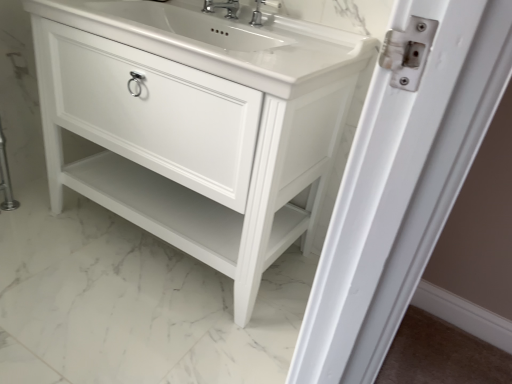
At what (x,y) coordinates should I click in order to perform the action: click on white glossy sink at center. Please return your answer as a coordinate pair (x, y). This screenshot has height=384, width=512. Looking at the image, I should click on (221, 42).

Image resolution: width=512 pixels, height=384 pixels. Describe the element at coordinates (196, 123) in the screenshot. I see `white glossy cabinet at center` at that location.

Locate an element on the screen. polished chrome faucet at upper center, which is the 1th tap from right to left is located at coordinates (264, 12).

Is white glossy cabinet at center in front of white glossy sink at center?

Yes, it is.

How different are the orientations of white glossy cabinet at center and white glossy sink at center in degrees?

white glossy cabinet at center and white glossy sink at center are facing 8.98e-05 degrees away from each other.

From a real-world perspective, which is physically below, white glossy cabinet at center or white glossy sink at center?

white glossy cabinet at center, from a real-world perspective.

Is white glossy sink at center a part of white glossy cabinet at center?

Yes, white glossy sink at center can be found within white glossy cabinet at center.

Is the position of polished chrome faucet at upper center, positioned as the 2th tap in left-to-right order, less distant than that of white glossy sink at center?

No, it is not.

From the image's perspective, is polished chrome faucet at upper center, positioned as the 2th tap in left-to-right order, located above or below white glossy sink at center?

Clearly, from the image's perspective, polished chrome faucet at upper center, positioned as the 2th tap in left-to-right order, is above white glossy sink at center.

Are polished chrome faucet at upper center, positioned as the 2th tap in left-to-right order, and white glossy sink at center located far from each other?

No, there isn't a large distance between polished chrome faucet at upper center, positioned as the 2th tap in left-to-right order, and white glossy sink at center.

Which object is thinner, polished chrome faucet at upper center, positioned as the 2th tap in left-to-right order, or white glossy sink at center?

polished chrome faucet at upper center, positioned as the 2th tap in left-to-right order, is thinner.

Which object is wider, white glossy sink at center or white glossy cabinet at center?

With larger width is white glossy cabinet at center.

From their relative heights in the image, would you say white glossy sink at center is taller or shorter than white glossy cabinet at center?

Clearly, white glossy sink at center is shorter compared to white glossy cabinet at center.

Looking at this image, is white glossy sink at center with white glossy cabinet at center?

No, white glossy sink at center is not in contact with white glossy cabinet at center.

From a real-world perspective, between white glossy sink at center and white glossy cabinet at center, who is vertically lower?

white glossy cabinet at center is physically lower.

Considering the positions of points (216, 3) and (337, 69), is point (216, 3) closer to camera compared to point (337, 69)?

That is False.

Is polished chrome faucet at upper center, the 2th tap from the right, positioned beyond the bounds of white glossy cabinet at center?

No, polished chrome faucet at upper center, the 2th tap from the right, is inside white glossy cabinet at center's boundary.

Are polished chrome faucet at upper center, the first tap viewed from the left, and white glossy cabinet at center located far from each other?

polished chrome faucet at upper center, the first tap viewed from the left, is near white glossy cabinet at center, not far away.

Considering the positions of point (230, 14) and point (248, 62), is point (230, 14) closer or farther from the camera than point (248, 62)?

Point (230, 14).

From a real-world perspective, relative to white glossy sink at center, is polished chrome faucet at upper center, the 2th tap from the right, vertically above or below?

polished chrome faucet at upper center, the 2th tap from the right, is situated higher than white glossy sink at center in the real world.

Can you confirm if polished chrome faucet at upper center, the first tap viewed from the left, is thinner than white glossy sink at center?

Indeed, polished chrome faucet at upper center, the first tap viewed from the left, has a lesser width compared to white glossy sink at center.

Can you confirm if polished chrome faucet at upper center, the first tap viewed from the left, is positioned to the left of white glossy sink at center?

Incorrect, polished chrome faucet at upper center, the first tap viewed from the left, is not on the left side of white glossy sink at center.

From the image's perspective, is white glossy cabinet at center under polished chrome faucet at upper center, the 2th tap from the right?

Yes, from the image's perspective, white glossy cabinet at center is below polished chrome faucet at upper center, the 2th tap from the right.

From a real-world perspective, is white glossy cabinet at center positioned above or below polished chrome faucet at upper center, the first tap viewed from the left?

Clearly, from a real-world perspective, white glossy cabinet at center is below polished chrome faucet at upper center, the first tap viewed from the left.

Is white glossy cabinet at center not near polished chrome faucet at upper center, the 2th tap from the right?

They are positioned close to each other.

The image size is (512, 384). Find the location of `bathroom cabinet below the polished chrome faucet at upper center, the 2th tap from the right (from the image's perspective)`. bathroom cabinet below the polished chrome faucet at upper center, the 2th tap from the right (from the image's perspective) is located at coordinates (196, 123).

Do you think polished chrome faucet at upper center, positioned as the 2th tap in left-to-right order, is within white glossy cabinet at center, or outside of it?

polished chrome faucet at upper center, positioned as the 2th tap in left-to-right order, is located inside white glossy cabinet at center.

Is polished chrome faucet at upper center, positioned as the 2th tap in left-to-right order, looking in the opposite direction of white glossy cabinet at center?

polished chrome faucet at upper center, positioned as the 2th tap in left-to-right order, does not have its back to white glossy cabinet at center.

Which of these two, polished chrome faucet at upper center, which is the 1th tap from right to left, or white glossy cabinet at center, stands taller?

With more height is white glossy cabinet at center.

From a real-world perspective, is polished chrome faucet at upper center, positioned as the 2th tap in left-to-right order, positioned over white glossy cabinet at center based on gravity?

Yes, from a real-world perspective, polished chrome faucet at upper center, positioned as the 2th tap in left-to-right order, is over white glossy cabinet at center

This screenshot has height=384, width=512. In order to click on counter top above the white glossy cabinet at center (from the image's perspective) in this screenshot , I will do `click(221, 42)`.

You are a GUI agent. You are given a task and a screenshot of the screen. Output one action in this format:
    pyautogui.click(x=<x>, y=<y>)
    Task: Click on the 2nd tap to the right when counting from the white glossy sink at center
    The image size is (512, 384).
    Given the screenshot: What is the action you would take?
    pyautogui.click(x=264, y=12)

Estimate the real-world distances between objects in this image. Which object is closer to polished chrome faucet at upper center, which is the 1th tap from right to left, white glossy sink at center or polished chrome faucet at upper center, the first tap viewed from the left?

Among the two, polished chrome faucet at upper center, the first tap viewed from the left, is located nearer to polished chrome faucet at upper center, which is the 1th tap from right to left.

From the image, which object appears to be nearer to polished chrome faucet at upper center, which is the 1th tap from right to left, polished chrome faucet at upper center, the first tap viewed from the left, or white glossy cabinet at center?

polished chrome faucet at upper center, the first tap viewed from the left.

When comparing their distances from polished chrome faucet at upper center, the first tap viewed from the left, does white glossy sink at center or polished chrome faucet at upper center, which is the 1th tap from right to left, seem further?

white glossy sink at center is positioned further to the anchor polished chrome faucet at upper center, the first tap viewed from the left.

Looking at the image, which one is located further to white glossy cabinet at center, polished chrome faucet at upper center, the first tap viewed from the left, or polished chrome faucet at upper center, which is the 1th tap from right to left?

polished chrome faucet at upper center, which is the 1th tap from right to left, is positioned further to the anchor white glossy cabinet at center.

Considering their positions, is polished chrome faucet at upper center, the 2th tap from the right, positioned further to white glossy sink at center than white glossy cabinet at center?

Based on the image, polished chrome faucet at upper center, the 2th tap from the right, appears to be further to white glossy sink at center.

Which object lies nearer to the anchor point white glossy cabinet at center, polished chrome faucet at upper center, which is the 1th tap from right to left, or polished chrome faucet at upper center, the first tap viewed from the left?

Based on the image, polished chrome faucet at upper center, the first tap viewed from the left, appears to be nearer to white glossy cabinet at center.

From the image, which object appears to be nearer to white glossy sink at center, polished chrome faucet at upper center, positioned as the 2th tap in left-to-right order, or white glossy cabinet at center?

white glossy cabinet at center lies closer to white glossy sink at center than the other object.

Considering their positions, is polished chrome faucet at upper center, which is the 1th tap from right to left, positioned further to white glossy sink at center than polished chrome faucet at upper center, the first tap viewed from the left?

polished chrome faucet at upper center, the first tap viewed from the left, lies further to white glossy sink at center than the other object.

The image size is (512, 384). What are the coordinates of `tap between polished chrome faucet at upper center, the 2th tap from the right, and white glossy cabinet at center in the up-down direction` in the screenshot? It's located at (264, 12).

What are the coordinates of `counter top between white glossy cabinet at center and polished chrome faucet at upper center, positioned as the 2th tap in left-to-right order, along the z-axis` in the screenshot? It's located at (221, 42).

This screenshot has width=512, height=384. In order to click on tap located between white glossy sink at center and polished chrome faucet at upper center, which is the 1th tap from right to left, in the depth direction in this screenshot , I will do `click(222, 7)`.

Locate an element on the screen. counter top between white glossy cabinet at center and polished chrome faucet at upper center, the first tap viewed from the left, from front to back is located at coordinates (221, 42).